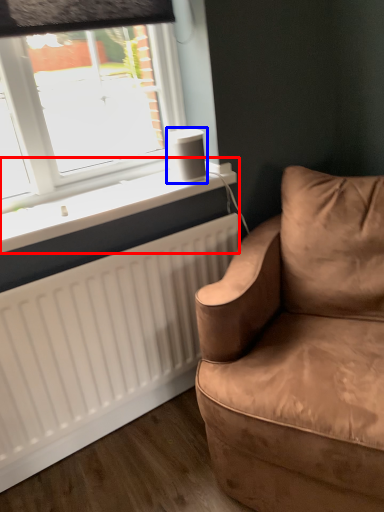
Question: Which object appears farthest to the camera in this image, window sill (highlighted by a red box) or speaker (highlighted by a blue box)?

Choices:
 (A) window sill
 (B) speaker

Answer: (B)